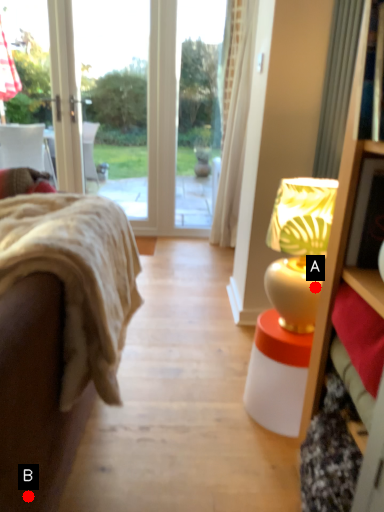
Question: Two points are circled on the image, labeled by A and B beside each circle. Which point is closer to the camera?

Choices:
 (A) A is closer
 (B) B is closer

Answer: (B)